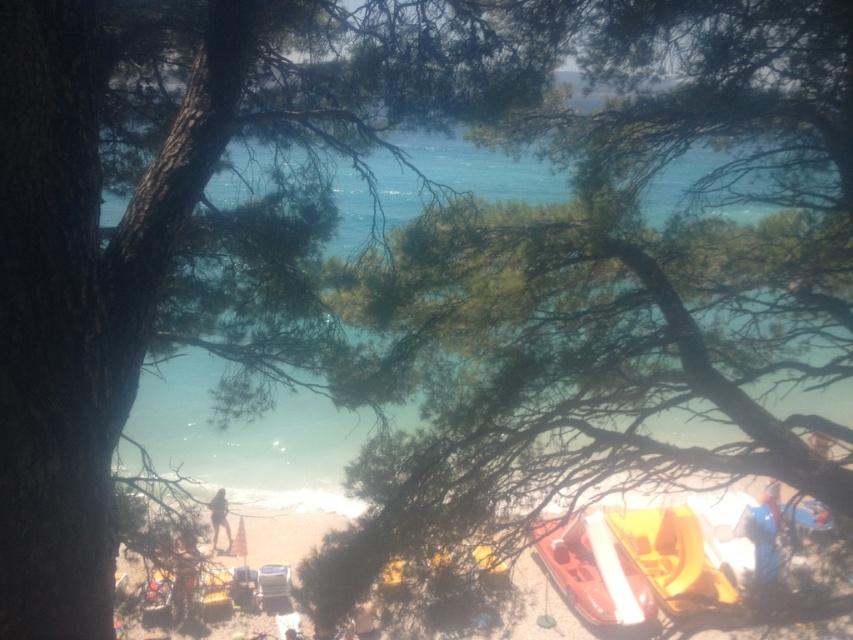
You are standing on the beach and want to choose between the matte orange kayak at lower center and the yellow plastic boat at lower right for a short trip. Which one would be more stable due to its height?

The matte orange kayak at lower center is much taller than the yellow plastic boat at lower right, making it more stable for a short trip.

You are standing at the base of the tree in the foreground of the beach scene. You want to place a new red beach umbrella exactly where the yellow plastic boat at lower right is currently located. Is this possible given the coordinates provided?

The yellow plastic boat at lower right is located at coordinates point (672, 557), so yes, you can place the new red beach umbrella there since the coordinates are specified.

You are a beachgoer who wants to place a 1 meter long surfboard between the matte orange kayak at lower center and the yellow plastic boat at lower right. Can the surfboard fit in the space between them?

The matte orange kayak at lower center is 83.25 centimeters away from the yellow plastic boat at lower right. Since the surfboard is 1 meter long, which is longer than the distance between them, the surfboard cannot fit in the space between the matte orange kayak at lower center and the yellow plastic boat at lower right.